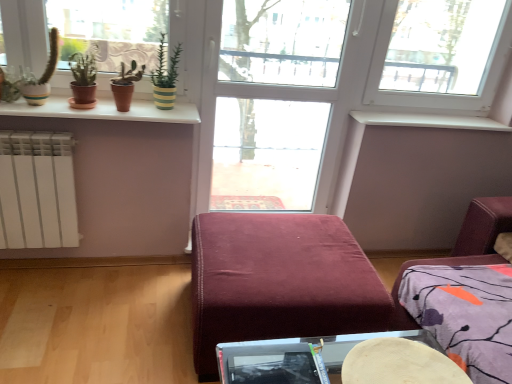
The height and width of the screenshot is (384, 512). I want to click on blank space above velvet burgundy ottoman at center (from a real-world perspective), so click(291, 252).